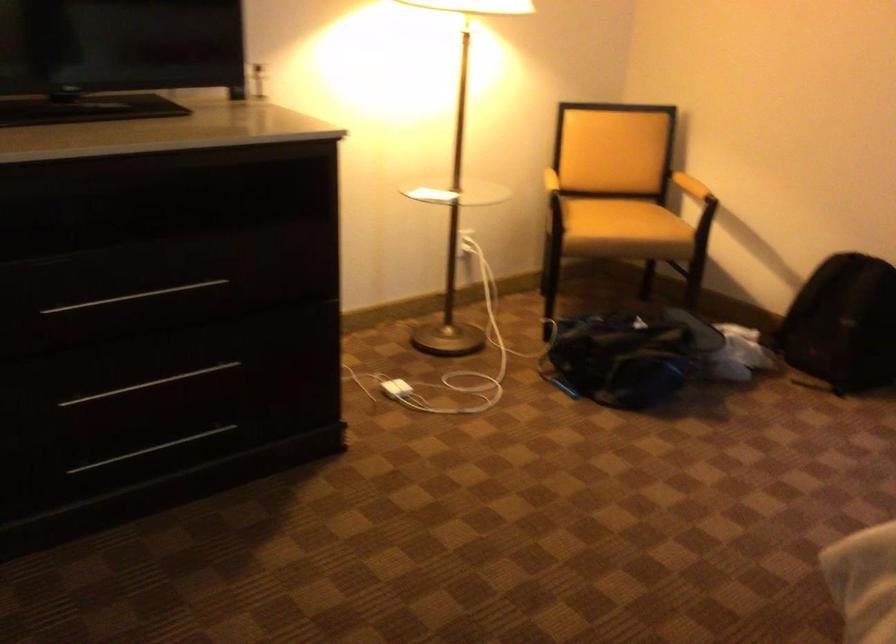
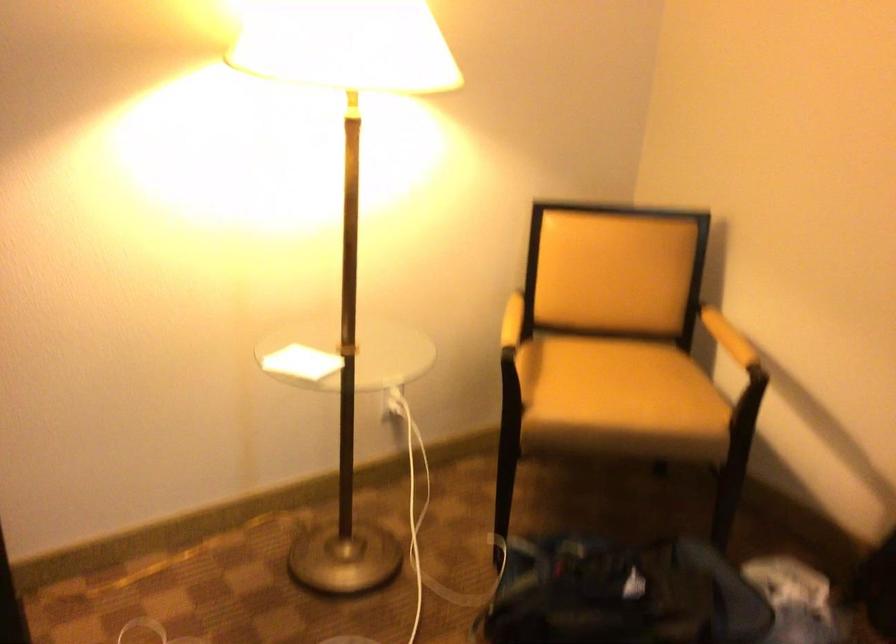
Where in the second image is the point corresponding to [686,178] from the first image?

(728, 337)